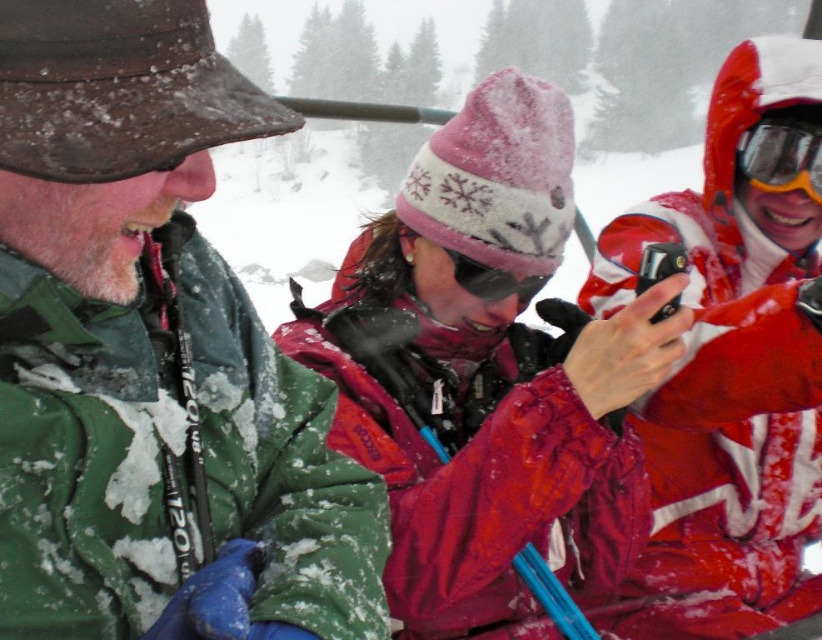
Is matte red jacket at right further to the viewer compared to matte orange goggles at upper right?

No, it is not.

Find the location of a particular element. matte red jacket at right is located at coordinates (732, 362).

Is matte pink knit hat at center to the right of matte orange goggles at upper right from the viewer's perspective?

In fact, matte pink knit hat at center is to the left of matte orange goggles at upper right.

Describe the element at coordinates (488, 381) in the screenshot. The image size is (822, 640). I see `matte pink knit hat at center` at that location.

Find the location of a particular element. matte pink knit hat at center is located at coordinates (488, 381).

Who is shorter, matte orange goggles at upper right or sunglasses at center?

Standing shorter between the two is sunglasses at center.

Can you confirm if matte orange goggles at upper right is taller than sunglasses at center?

Indeed, matte orange goggles at upper right has a greater height compared to sunglasses at center.

Find the location of a particular element. This screenshot has height=640, width=822. matte orange goggles at upper right is located at coordinates (781, 156).